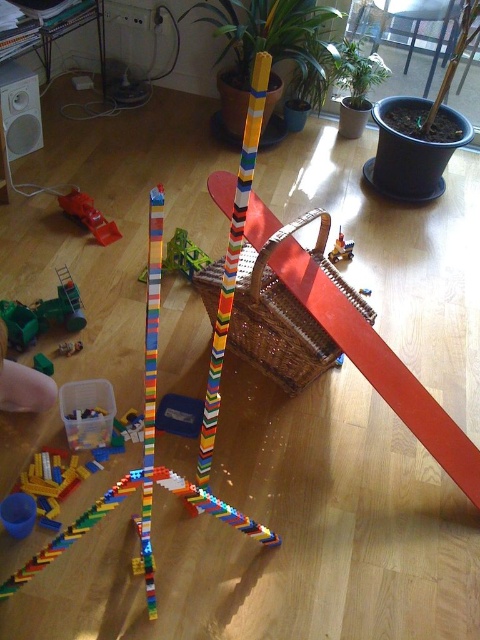
Question: Can you confirm if green matte toy car at lower left is positioned to the right of matte plastic toy at center?

Choices:
 (A) no
 (B) yes

Answer: (A)

Question: Which of the following is the farthest from the observer?

Choices:
 (A) green matte toy at lower left
 (B) smooth skin hand at lower left

Answer: (A)

Question: From the image, what is the correct spatial relationship of smooth skin hand at lower left in relation to metallic silver toy car at lower left?

Choices:
 (A) below
 (B) above

Answer: (A)

Question: Is matte plastic toy at center above green matte toy at lower left?

Choices:
 (A) yes
 (B) no

Answer: (A)

Question: Which object is positioned farthest from the matte plastic toy at center?

Choices:
 (A) smooth skin hand at lower left
 (B) metallic silver toy car at lower left
 (C) translucent plastic toy at center

Answer: (A)

Question: Which object is farther from the camera taking this photo?

Choices:
 (A) metallic silver toy car at lower left
 (B) matte plastic toy at center
 (C) green matte toy at lower left

Answer: (B)